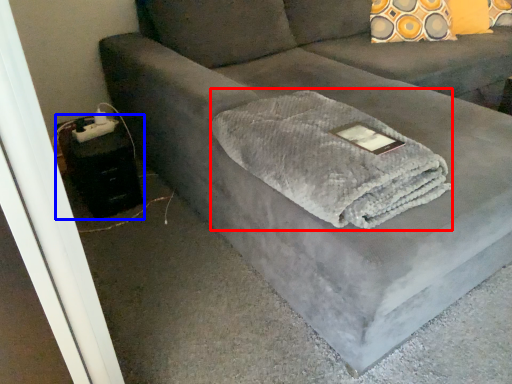
Question: Which of the following is the farthest to the observer, bath towel (highlighted by a red box) or table (highlighted by a blue box)?

Choices:
 (A) bath towel
 (B) table

Answer: (B)